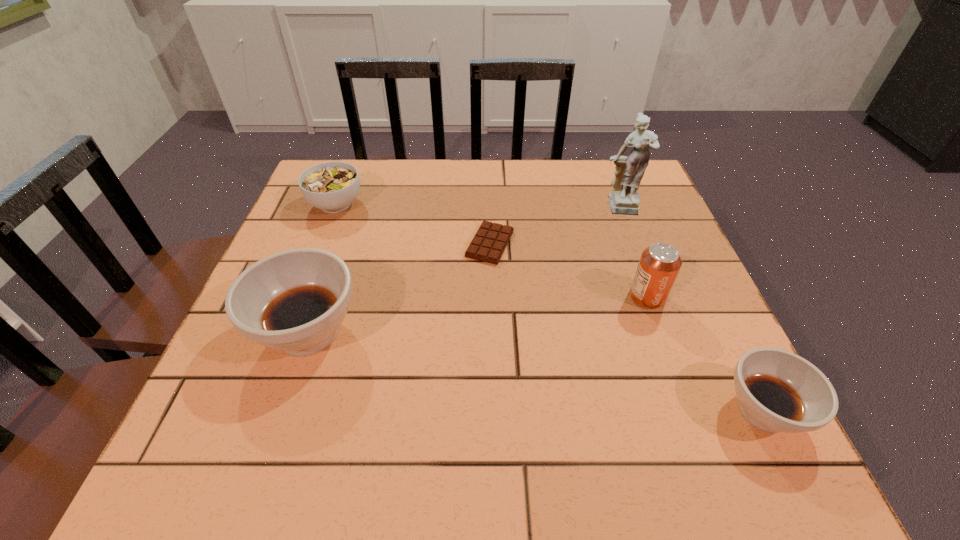
To make them evenly spaced by inserting another soup_bowl among them, please locate a free space for this new soup_bowl. Please provide its 2D coordinates. Your answer should be formatted as a tuple, i.e. [(x, y)], where the tuple contains the x and y coordinates of a point satisfying the conditions above.

[(519, 368)]